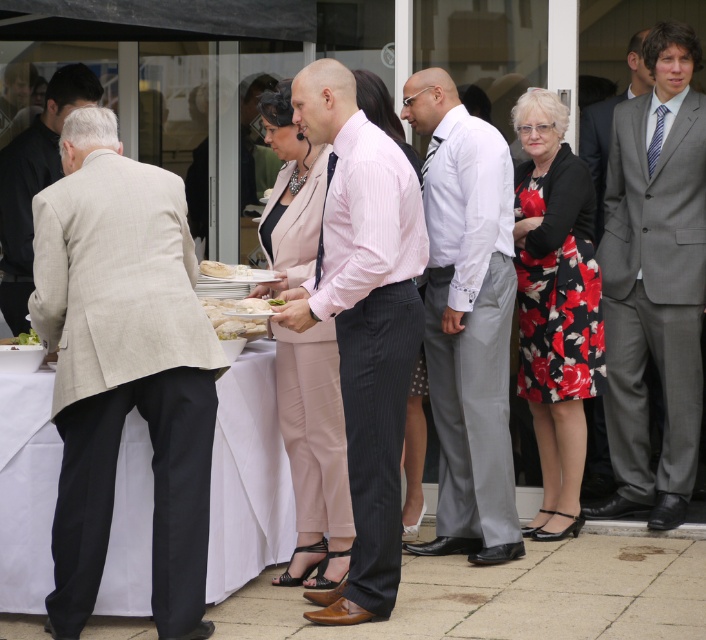
You are standing at the glass door and want to walk to the point labeled as point (35, 147). There is an obstacle at point (561, 198). Will you need to go around it?

Point (561, 198) is in front of point (35, 147), so you will need to go around the obstacle at point (561, 198) to reach your destination.